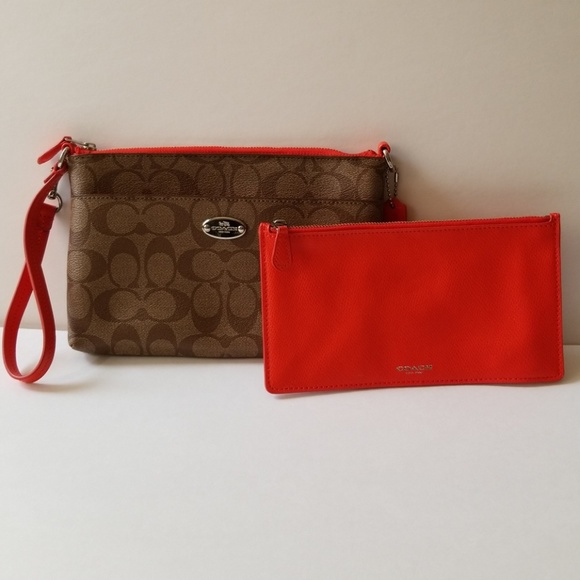
Locate an element on the screen. This screenshot has width=580, height=580. wall is located at coordinates (525, 103).